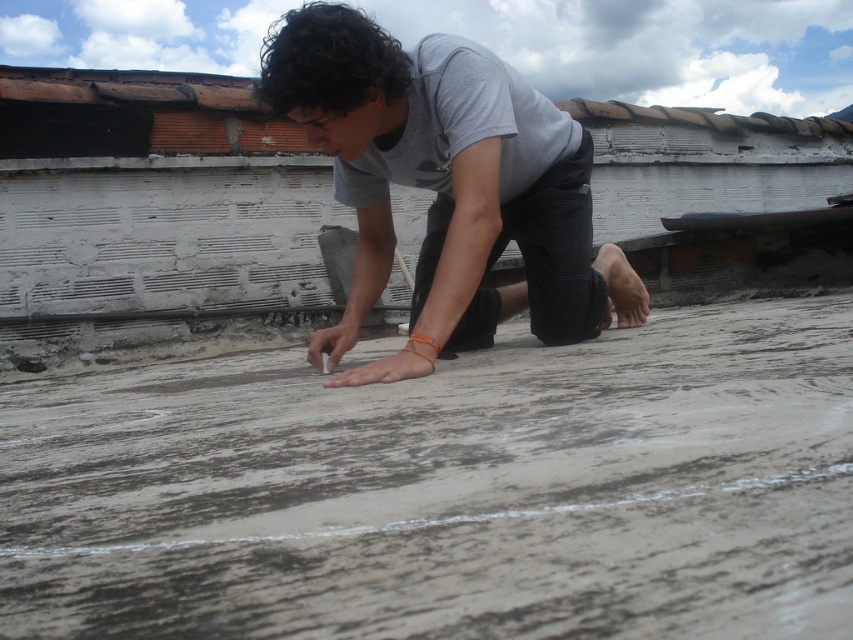
From the picture: Is gray concrete at center positioned behind gray matte shirt at center?

No, gray concrete at center is in front of gray matte shirt at center.

Which is in front, point (334, 589) or point (312, 8)?

Positioned in front is point (334, 589).

Is point (503, 595) farther from camera compared to point (439, 134)?

No.

The width and height of the screenshot is (853, 640). I want to click on gray concrete at center, so coord(447,490).